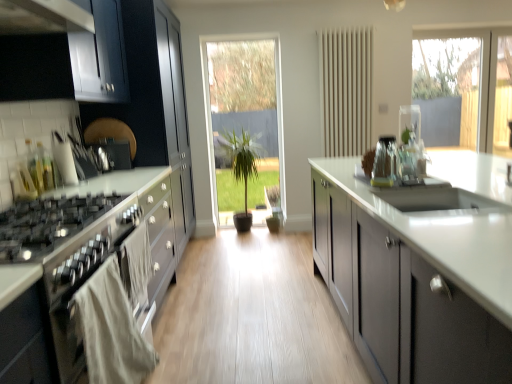
In order to face satin silver toaster at upper left, which is counted as the 3th appliance, starting from the front, should I rotate leftwards or rightwards?

Turn left by 19.725 degrees to look at satin silver toaster at upper left, which is counted as the 3th appliance, starting from the front.

This screenshot has height=384, width=512. What do you see at coordinates (244, 119) in the screenshot? I see `transparent glass door at center` at bounding box center [244, 119].

This screenshot has width=512, height=384. Describe the element at coordinates (420, 269) in the screenshot. I see `matte gray cabinets at center, the 2th cabinetry when ordered from back to front` at that location.

Where is `satin black oven at left`? satin black oven at left is located at coordinates (95, 310).

Between transparent glass door at center and clear glass vase at center, positioned as the second appliance in left-to-right order, which one has smaller width?

Thinner between the two is transparent glass door at center.

Is the position of transparent glass door at center less distant than that of clear glass vase at center, positioned as the second appliance in left-to-right order?

No.

Is transparent glass door at center oriented towards clear glass vase at center, the second appliance when ordered from right to left?

Yes, transparent glass door at center is facing clear glass vase at center, the second appliance when ordered from right to left.

Does transparent glass door at center appear on the right side of clear glass vase at center, positioned as the third appliance in back-to-front order?

Incorrect, transparent glass door at center is not on the right side of clear glass vase at center, positioned as the third appliance in back-to-front order.

Identify the location of glass door behind the matte gray cabinets at center, the 1th cabinetry in the front-to-back sequence. [x=244, y=119].

From the picture: Can you confirm if transparent glass door at center is bigger than matte gray cabinets at center, acting as the second cabinetry starting from the left?

Incorrect, transparent glass door at center is not larger than matte gray cabinets at center, acting as the second cabinetry starting from the left.

Is transparent glass door at center further to camera compared to matte gray cabinets at center, the 2th cabinetry when ordered from back to front?

Yes, transparent glass door at center is further from the camera.

Which object is positioned more to the left, matte black cabinets at left, positioned as the 2th cabinetry in front-to-back order, or clear glass vase at upper center, the second appliance viewed from the back?

matte black cabinets at left, positioned as the 2th cabinetry in front-to-back order.

Looking at this image, is matte black cabinets at left, the first cabinetry in the left-to-right sequence, far from clear glass vase at upper center, acting as the second appliance starting from the front?

That's right, there is a large distance between matte black cabinets at left, the first cabinetry in the left-to-right sequence, and clear glass vase at upper center, acting as the second appliance starting from the front.

How many degrees apart are the facing directions of matte black cabinets at left, which is counted as the 1th cabinetry, starting from the back, and clear glass vase at upper center, the 1th appliance from the right?

The facing directions of matte black cabinets at left, which is counted as the 1th cabinetry, starting from the back, and clear glass vase at upper center, the 1th appliance from the right, are 174 degrees apart.

From a real-world perspective, does matte black cabinets at left, positioned as the 2th cabinetry in front-to-back order, stand above clear glass vase at upper center, acting as the second appliance starting from the front?

Incorrect, from a real-world perspective, matte black cabinets at left, positioned as the 2th cabinetry in front-to-back order, is lower than clear glass vase at upper center, acting as the second appliance starting from the front.

Is transparent glass door at center inside or outside of satin black gas stove at left?

transparent glass door at center is not inside satin black gas stove at left, it's outside.

Considering the sizes of objects transparent glass door at center and satin black gas stove at left in the image provided, who is bigger, transparent glass door at center or satin black gas stove at left?

With larger size is satin black gas stove at left.

Is transparent glass door at center oriented away from satin black gas stove at left?

No.

The height and width of the screenshot is (384, 512). I want to click on glass door above the satin black gas stove at left (from a real-world perspective), so click(244, 119).

Can you confirm if clear glass vase at upper center, the 1th appliance from the right, is wider than green matte plant at center?

In fact, clear glass vase at upper center, the 1th appliance from the right, might be narrower than green matte plant at center.

Are clear glass vase at upper center, which is counted as the third appliance, starting from the left, and green matte plant at center making contact?

No, clear glass vase at upper center, which is counted as the third appliance, starting from the left, is not with green matte plant at center.

Considering the sizes of objects clear glass vase at upper center, the second appliance viewed from the back, and green matte plant at center in the image provided, who is shorter, clear glass vase at upper center, the second appliance viewed from the back, or green matte plant at center?

Standing shorter between the two is clear glass vase at upper center, the second appliance viewed from the back.

Is clear glass vase at upper center, acting as the second appliance starting from the front, further to the viewer compared to green matte plant at center?

No.

From the picture: In terms of size, does satin silver toaster at upper left, the 3th appliance when ordered from right to left, appear bigger or smaller than matte black cabinets at left, positioned as the 2th cabinetry in front-to-back order?

satin silver toaster at upper left, the 3th appliance when ordered from right to left, is smaller than matte black cabinets at left, positioned as the 2th cabinetry in front-to-back order.

Which of these two, satin silver toaster at upper left, the 3th appliance when ordered from right to left, or matte black cabinets at left, which ranks as the 2th cabinetry in right-to-left order, is wider?

matte black cabinets at left, which ranks as the 2th cabinetry in right-to-left order, is wider.

Which object is closer to the camera taking this photo, satin silver toaster at upper left, the 1th appliance from the back, or matte black cabinets at left, positioned as the 2th cabinetry in front-to-back order?

satin silver toaster at upper left, the 1th appliance from the back, is closer to the camera.

You are a GUI agent. You are given a task and a screenshot of the screen. Output one action in this format:
    pyautogui.click(x=<x>, y=<y>)
    Task: Click on the glass door on the left of clear glass vase at upper center, the second appliance viewed from the back
    The image size is (512, 384).
    Given the screenshot: What is the action you would take?
    pyautogui.click(x=244, y=119)

Does transparent glass door at center have a greater height compared to clear glass vase at upper center, the second appliance viewed from the back?

Yes, transparent glass door at center is taller than clear glass vase at upper center, the second appliance viewed from the back.

Considering the points (241, 56) and (412, 118), which point is in front, point (241, 56) or point (412, 118)?

Point (412, 118)

Looking at this image, considering the positions of objects transparent glass door at center and clear glass vase at upper center, the second appliance viewed from the back, in the image provided, who is in front, transparent glass door at center or clear glass vase at upper center, the second appliance viewed from the back,?

clear glass vase at upper center, the second appliance viewed from the back.

Locate an element on the screen. The image size is (512, 384). glass door located on the left of clear glass vase at center, which is the first appliance from front to back is located at coordinates (244, 119).

You are a GUI agent. You are given a task and a screenshot of the screen. Output one action in this format:
    pyautogui.click(x=<x>, y=<y>)
    Task: Click on the glass door above the matte gray cabinets at center, which appears as the first cabinetry when viewed from the right (from the image's perspective)
    
    Given the screenshot: What is the action you would take?
    pyautogui.click(x=244, y=119)

Considering their positions, is matte gray cabinets at center, which appears as the first cabinetry when viewed from the right, positioned closer to clear glass vase at center, positioned as the second appliance in left-to-right order, than transparent glass door at center?

matte gray cabinets at center, which appears as the first cabinetry when viewed from the right, lies closer to clear glass vase at center, positioned as the second appliance in left-to-right order, than the other object.

Estimate the real-world distances between objects in this image. Which object is closer to clear glass vase at center, the second appliance when ordered from right to left, green matte plant at center or satin black gas stove at left?

Among the two, satin black gas stove at left is located nearer to clear glass vase at center, the second appliance when ordered from right to left.

When comparing their distances from satin black oven at left, does clear glass vase at upper center, which is counted as the third appliance, starting from the left, or satin silver toaster at upper left, which is counted as the first appliance, starting from the left, seem closer?

Among the two, satin silver toaster at upper left, which is counted as the first appliance, starting from the left, is located nearer to satin black oven at left.

Estimate the real-world distances between objects in this image. Which object is further from satin silver toaster at upper left, the 1th appliance from the back, clear glass vase at center, positioned as the second appliance in left-to-right order, or matte black cabinets at left, which is counted as the 1th cabinetry, starting from the back?

Based on the image, clear glass vase at center, positioned as the second appliance in left-to-right order, appears to be further to satin silver toaster at upper left, the 1th appliance from the back.

Which object lies nearer to the anchor point green matte plant at center, clear glass vase at upper center, the 1th appliance from the right, or satin black oven at left?

clear glass vase at upper center, the 1th appliance from the right, is closer to green matte plant at center.

From the image, which object appears to be farther from green matte plant at center, transparent glass door at center or matte black cabinets at left, positioned as the 2th cabinetry in front-to-back order?

matte black cabinets at left, positioned as the 2th cabinetry in front-to-back order, lies further to green matte plant at center than the other object.

From the picture: Looking at the image, which one is located further to clear glass vase at upper center, the 1th appliance from the right, matte black cabinets at left, which ranks as the 2th cabinetry in right-to-left order, or matte gray cabinets at center, the 2th cabinetry when ordered from back to front?

matte gray cabinets at center, the 2th cabinetry when ordered from back to front, is positioned further to the anchor clear glass vase at upper center, the 1th appliance from the right.

Based on their spatial positions, is satin black oven at left or matte black cabinets at left, positioned as the 2th cabinetry in front-to-back order, closer to satin silver toaster at upper left, the 3th appliance when ordered from right to left?

Among the two, matte black cabinets at left, positioned as the 2th cabinetry in front-to-back order, is located nearer to satin silver toaster at upper left, the 3th appliance when ordered from right to left.

Locate an element on the screen. appliance between matte gray cabinets at center, the 2th cabinetry when ordered from back to front, and clear glass vase at upper center, the second appliance viewed from the back, from front to back is located at coordinates (385, 163).

In order to click on appliance between matte black cabinets at left, which is counted as the 1th cabinetry, starting from the back, and clear glass vase at upper center, acting as the second appliance starting from the front, from left to right in this screenshot , I will do `click(385, 163)`.

Find the location of a particular element. The width and height of the screenshot is (512, 384). cabinetry between satin black gas stove at left and green matte plant at center in the front-back direction is located at coordinates (54, 295).

The image size is (512, 384). Identify the location of cabinetry located between satin silver toaster at upper left, the 3th appliance when ordered from right to left, and clear glass vase at center, which is the first appliance from front to back, in the left-right direction. (54, 295).